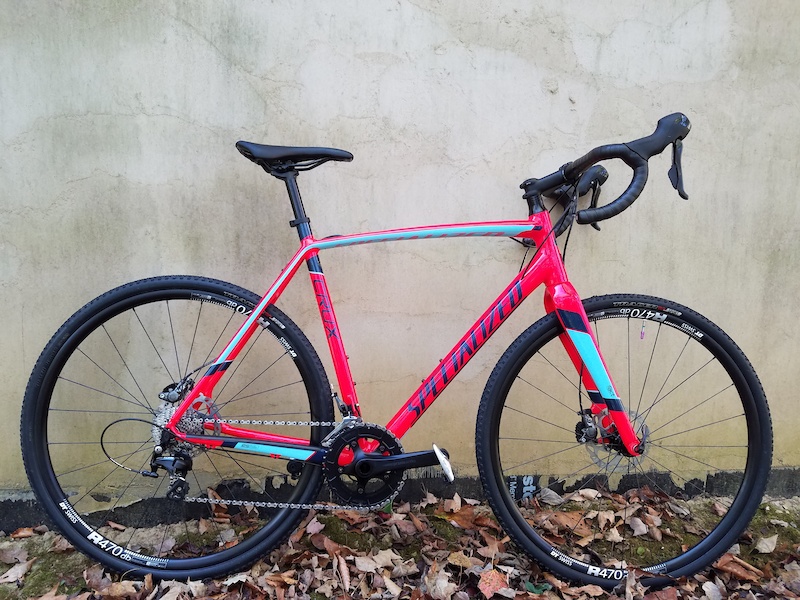
You are a GUI agent. You are given a task and a screenshot of the screen. Output one action in this format:
    pyautogui.click(x=<x>, y=<y>)
    Task: Click on the handles
    This screenshot has width=800, height=600.
    Given the screenshot: What is the action you would take?
    pyautogui.click(x=622, y=203), pyautogui.click(x=562, y=223)